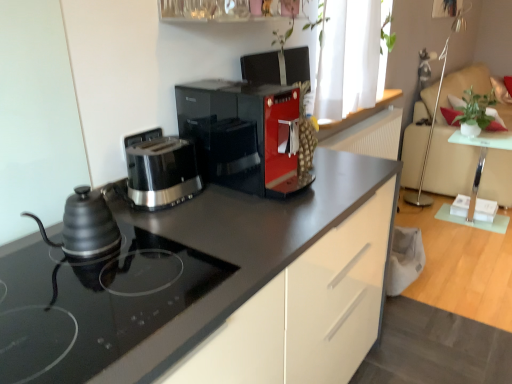
Measure the distance between matte black kettle at left and camera.

matte black kettle at left and camera are 39.21 inches apart from each other.

I want to click on black matte kettle at left, so click(x=93, y=304).

This screenshot has height=384, width=512. What do you see at coordinates (162, 172) in the screenshot?
I see `satin black toaster at left` at bounding box center [162, 172].

Find the location of a particular element. The image size is (512, 384). green matte plant at upper right is located at coordinates (475, 111).

Is point (507, 118) farther from viewer compared to point (503, 143)?

Yes, point (507, 118) is behind point (503, 143).

Locate an element on the screen. The width and height of the screenshot is (512, 384). table lying below the white fabric chair at right (from the image's perspective) is located at coordinates (481, 157).

Which object is positioned more to the right, white fabric chair at right or clear glass table at right?

Positioned to the right is white fabric chair at right.

From the image's perspective, which one is positioned higher, matte black coffee maker at center or clear glass shelf at upper center?

clear glass shelf at upper center.

Considering the relative positions of matte black coffee maker at center and clear glass shelf at upper center in the image provided, is matte black coffee maker at center to the right of clear glass shelf at upper center from the viewer's perspective?

Yes.

This screenshot has height=384, width=512. I want to click on coffee maker on the right of clear glass shelf at upper center, so click(x=242, y=134).

What's the angular difference between matte black coffee maker at center and clear glass shelf at upper center's facing directions?

They differ by 1.03 degrees in their facing directions.

In order to click on window on the left of green matte plant at upper right in this screenshot , I will do `click(348, 58)`.

Is white fabric window at upper right oriented away from green matte plant at upper right?

white fabric window at upper right does not have its back to green matte plant at upper right.

From the image's perspective, which is below, white fabric window at upper right or green matte plant at upper right?

green matte plant at upper right.

Which is in front, white fabric window at upper right or green matte plant at upper right?

white fabric window at upper right is more forward.

From the image's perspective, is clear glass table at right beneath black matte kettle at left?

No, from the image's perspective, clear glass table at right is not below black matte kettle at left.

Is clear glass table at right touching black matte kettle at left?

No, clear glass table at right is not making contact with black matte kettle at left.

Is clear glass table at right looking in the opposite direction of black matte kettle at left?

clear glass table at right does not have its back to black matte kettle at left.

Which is more to the right, clear glass table at right or black matte kettle at left?

clear glass table at right is more to the right.

Is point (443, 93) behind point (331, 65)?

Yes, it is behind point (331, 65).

Visually, is white fabric chair at right positioned to the left or to the right of white fabric window at upper right?

white fabric chair at right is positioned on white fabric window at upper right's right side.

Is white fabric chair at right thinner than white fabric window at upper right?

Incorrect, the width of white fabric chair at right is not less than that of white fabric window at upper right.

From a real-world perspective, who is located lower, white fabric chair at right or white fabric window at upper right?

From a 3D spatial view, white fabric chair at right is below.

From the image's perspective, who appears lower, white fabric window at upper right or clear glass shelf at upper center?

clear glass shelf at upper center, from the image's perspective.

Find the location of a particular element. window on the right side of clear glass shelf at upper center is located at coordinates (348, 58).

How many degrees apart are the facing directions of white fabric window at upper right and clear glass shelf at upper center?

white fabric window at upper right and clear glass shelf at upper center are facing 0.0416 degrees away from each other.

Does white fabric chair at right appear on the right side of matte black coffee maker at center?

Yes, white fabric chair at right is to the right of matte black coffee maker at center.

From a real-world perspective, does white fabric chair at right stand above matte black coffee maker at center?

No, from a real-world perspective, white fabric chair at right is not over matte black coffee maker at center

From the picture: From the image's perspective, relative to matte black coffee maker at center, is white fabric chair at right above or below?

Clearly, from the image's perspective, white fabric chair at right is above matte black coffee maker at center.

The height and width of the screenshot is (384, 512). What are the coordinates of `table to the left of white fabric chair at right` in the screenshot? It's located at tap(481, 157).

You are a GUI agent. You are given a task and a screenshot of the screen. Output one action in this format:
    pyautogui.click(x=<x>, y=<y>)
    Task: Click on the shelf located above the matte black coffee maker at center (from the image's perspective)
    The width and height of the screenshot is (512, 384).
    Given the screenshot: What is the action you would take?
    pyautogui.click(x=229, y=10)

Considering their positions, is satin black toaster at left positioned further to white fabric window at upper right than clear glass shelf at upper center?

Based on the image, satin black toaster at left appears to be further to white fabric window at upper right.

Which object lies nearer to the anchor point black matte kettle at left, clear glass table at right or white fabric chair at right?

clear glass table at right is positioned closer to the anchor black matte kettle at left.

Considering their positions, is clear glass shelf at upper center positioned further to white fabric window at upper right than clear glass table at right?

Based on the image, clear glass table at right appears to be further to white fabric window at upper right.

Which object lies nearer to the anchor point clear glass table at right, green matte plant at upper right or white fabric window at upper right?

The object closer to clear glass table at right is green matte plant at upper right.

When comparing their distances from satin black toaster at left, does black matte kettle at left or matte black coffee maker at center seem further?

black matte kettle at left is positioned further to the anchor satin black toaster at left.

Based on their spatial positions, is matte black kettle at left or black matte kettle at left further from white fabric window at upper right?

matte black kettle at left is positioned further to the anchor white fabric window at upper right.

Considering their positions, is black matte kettle at left positioned closer to matte black coffee maker at center than satin black toaster at left?

Among the two, satin black toaster at left is located nearer to matte black coffee maker at center.

Based on their spatial positions, is black matte kettle at left or matte black coffee maker at center closer to clear glass table at right?

The object closer to clear glass table at right is matte black coffee maker at center.

I want to click on kitchen appliance between matte black kettle at left and clear glass table at right, so click(x=162, y=172).

Identify the location of kitchen appliance between black matte kettle at left and white fabric window at upper right from front to back. The image size is (512, 384). (162, 172).

Where is `coffee maker located between matte black kettle at left and clear glass table at right in the left-right direction`? This screenshot has height=384, width=512. coffee maker located between matte black kettle at left and clear glass table at right in the left-right direction is located at coordinates (242, 134).

Identify the location of table between white fabric window at upper right and green matte plant at upper right from front to back. This screenshot has height=384, width=512. (481, 157).